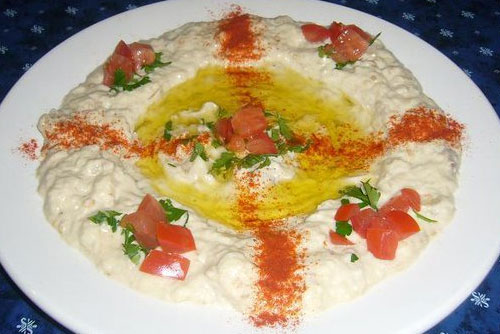
Find the location of a particular element. This screenshot has width=500, height=334. blue tablecloth with white designs is located at coordinates (22, 320), (477, 317), (479, 58), (440, 20), (55, 10), (16, 60).